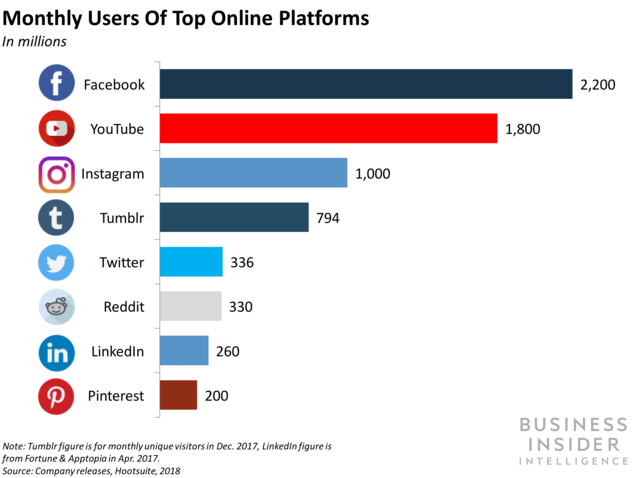
Where is `burgundy bar`? burgundy bar is located at coordinates (178, 402).